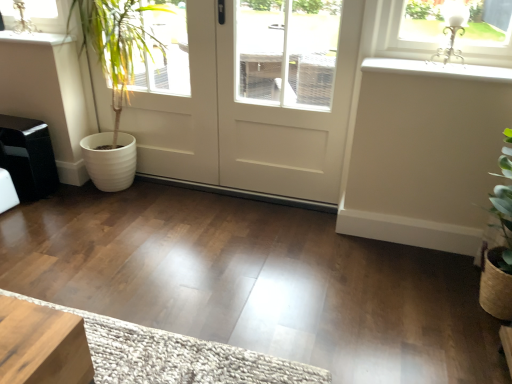
This screenshot has width=512, height=384. Find the location of `free space between white matte door at center and white textured doormat at lower center`. free space between white matte door at center and white textured doormat at lower center is located at coordinates (203, 251).